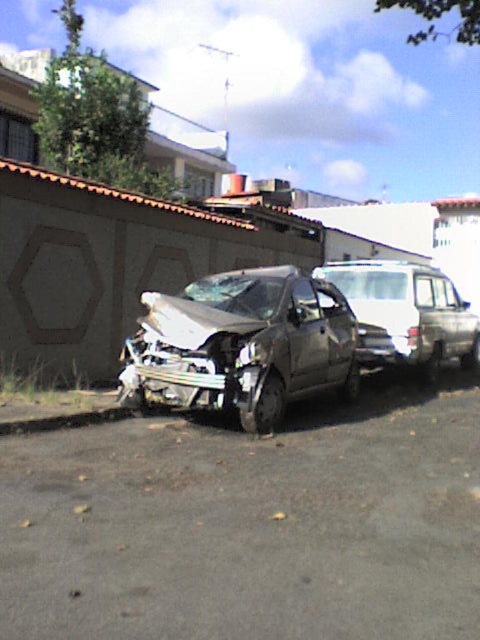
Is silver metallic car at center smaller than silver metallic van at center?

Incorrect, silver metallic car at center is not smaller in size than silver metallic van at center.

From the picture: Who is lower down, silver metallic car at center or silver metallic van at center?

silver metallic car at center is below.

Is point (312, 355) more distant than point (370, 349)?

No, it is in front of (370, 349).

Find the location of a particular element. This screenshot has height=640, width=480. silver metallic car at center is located at coordinates (240, 346).